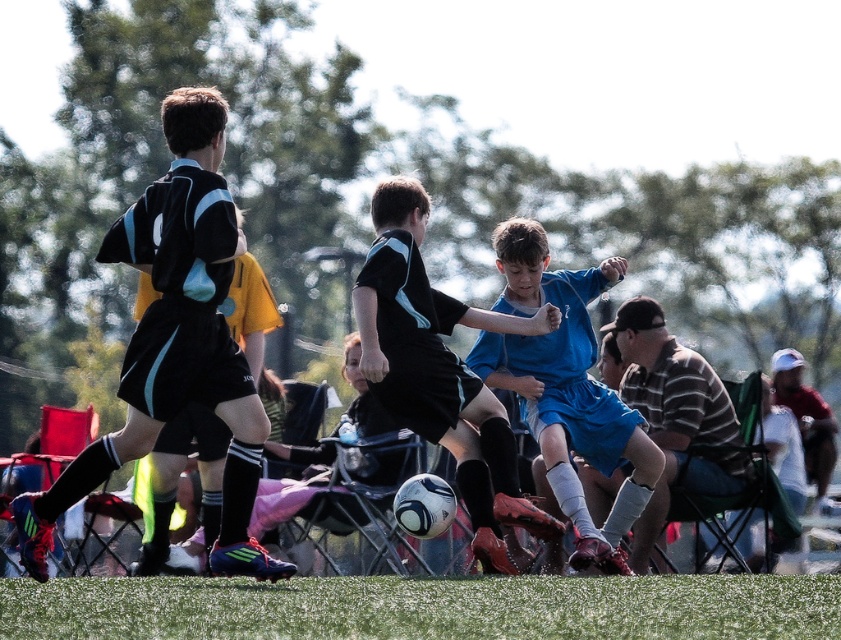
Question: Is blue matte shorts at center below striped cotton shirt at center?

Choices:
 (A) yes
 (B) no

Answer: (B)

Question: Can you confirm if blue matte soccer ball at center is bigger than striped cotton shirt at center?

Choices:
 (A) yes
 (B) no

Answer: (B)

Question: Which point is farther to the camera?

Choices:
 (A) blue matte soccer ball at center
 (B) reddish-brown fabric cap at upper right
 (C) striped cotton shirt at center

Answer: (B)

Question: Which point is closer to the camera?

Choices:
 (A) (668, 504)
 (B) (813, 404)
 (C) (220, 403)
 (D) (289, 588)

Answer: (D)

Question: Considering the relative positions of green artificial turf at center and reddish-brown fabric cap at upper right in the image provided, where is green artificial turf at center located with respect to reddish-brown fabric cap at upper right?

Choices:
 (A) left
 (B) right

Answer: (A)

Question: Which point is farther to the camera?

Choices:
 (A) (434, 401)
 (B) (226, 538)

Answer: (A)